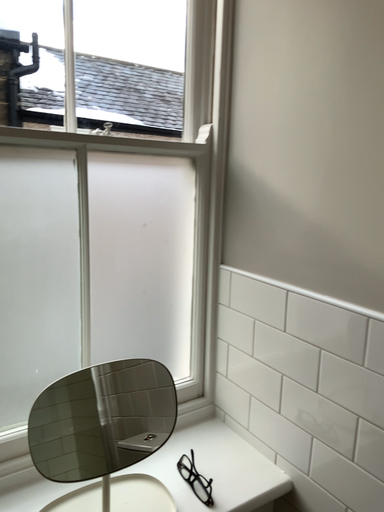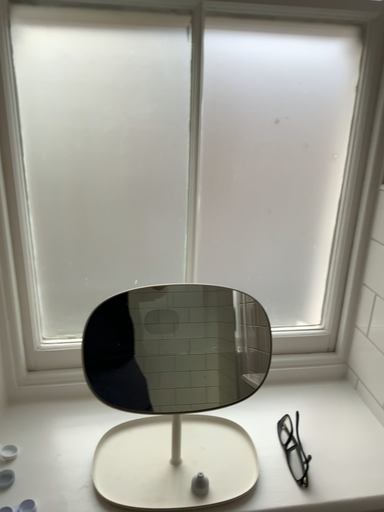
Question: How did the camera likely rotate when shooting the video?

Choices:
 (A) rotated upward
 (B) rotated downward

Answer: (B)